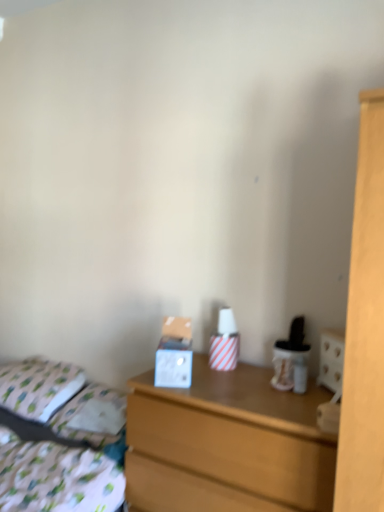
Describe the element at coordinates (227, 444) in the screenshot. The height and width of the screenshot is (512, 384). I see `wooden chest of drawers at center` at that location.

The height and width of the screenshot is (512, 384). What are the coordinates of `wooden chest of drawers at center` in the screenshot? It's located at (227, 444).

Is point (116, 481) positioned after point (169, 437)?

Yes, point (116, 481) is farther from viewer.

Who is bigger, patterned fabric bed at lower left or wooden chest of drawers at center?

patterned fabric bed at lower left.

Is patterned fabric bed at lower left looking in the opposite direction of wooden chest of drawers at center?

No, patterned fabric bed at lower left is not facing away from wooden chest of drawers at center.

Which of these two, wooden chest of drawers at center or patterned fabric bed at lower left, is bigger?

patterned fabric bed at lower left.

Does wooden chest of drawers at center come behind patterned fabric bed at lower left?

Yes, it is behind patterned fabric bed at lower left.

Which is less distant, [197,393] or [23,445]?

The point [197,393] is in front.

Based on the photo, is wooden chest of drawers at center positioned with its back to patterned fabric bed at lower left?

wooden chest of drawers at center is not turned away from patterned fabric bed at lower left.

Is patterned fabric bed at lower left looking in the opposite direction of white fabric pillow at left?

patterned fabric bed at lower left does not have its back to white fabric pillow at left.

From the image's perspective, is patterned fabric bed at lower left on top of white fabric pillow at left?

No, from the image's perspective, patterned fabric bed at lower left is not above white fabric pillow at left.

From a real-world perspective, who is located higher, patterned fabric bed at lower left or white fabric pillow at left?

white fabric pillow at left.

Considering the positions of objects white fabric pillow at left and wooden chest of drawers at center in the image provided, who is more to the left, white fabric pillow at left or wooden chest of drawers at center?

white fabric pillow at left.

From the image's perspective, does white fabric pillow at left appear lower than wooden chest of drawers at center?

Incorrect, from the image's perspective, white fabric pillow at left is higher than wooden chest of drawers at center.

Does point (55, 408) lie behind point (204, 388)?

Yes, point (55, 408) is farther from viewer.

Looking at the image, does white fabric pillow at left seem bigger or smaller compared to wooden chest of drawers at center?

white fabric pillow at left is smaller than wooden chest of drawers at center.

Which is in front, point (165, 454) or point (20, 398)?

The point (165, 454) is closer to the camera.

Could you tell me if wooden chest of drawers at center is facing white fabric pillow at left?

No, wooden chest of drawers at center is not aimed at white fabric pillow at left.

Between wooden chest of drawers at center and white fabric pillow at left, which one is positioned in front?

Positioned in front is wooden chest of drawers at center.

Would you say wooden chest of drawers at center is to the left or to the right of white fabric pillow at left in the picture?

Clearly, wooden chest of drawers at center is on the right of white fabric pillow at left in the image.

Which is more to the right, white fabric pillow at left or patterned fabric bed at lower left?

From the viewer's perspective, patterned fabric bed at lower left appears more on the right side.

What's the angular difference between white fabric pillow at left and patterned fabric bed at lower left's facing directions?

3.65 degrees.

Would you say patterned fabric bed at lower left is part of white fabric pillow at left's contents?

No, patterned fabric bed at lower left is not surrounded by white fabric pillow at left.

Based on the photo, between white fabric pillow at left and patterned fabric bed at lower left, which one has less height?

white fabric pillow at left is shorter.

Where is `bed located below the wooden chest of drawers at center (from the image's perspective)`? The width and height of the screenshot is (384, 512). bed located below the wooden chest of drawers at center (from the image's perspective) is located at coordinates (59, 439).

At what (x,y) coordinates should I click in order to perform the action: click on bed that appears below the wooden chest of drawers at center (from a real-world perspective). Please return your answer as a coordinate pair (x, y). This screenshot has height=512, width=384. Looking at the image, I should click on (59, 439).

Which object lies further to the anchor point wooden chest of drawers at center, white fabric pillow at left or patterned fabric bed at lower left?

white fabric pillow at left is further to wooden chest of drawers at center.

Based on their spatial positions, is wooden chest of drawers at center or patterned fabric bed at lower left closer to white fabric pillow at left?

The object closer to white fabric pillow at left is patterned fabric bed at lower left.

Looking at the image, which one is located further to patterned fabric bed at lower left, white fabric pillow at left or wooden chest of drawers at center?

wooden chest of drawers at center is positioned further to the anchor patterned fabric bed at lower left.

Considering their positions, is patterned fabric bed at lower left positioned closer to white fabric pillow at left than wooden chest of drawers at center?

patterned fabric bed at lower left is closer to white fabric pillow at left.

Considering their positions, is patterned fabric bed at lower left positioned further to wooden chest of drawers at center than white fabric pillow at left?

Based on the image, white fabric pillow at left appears to be further to wooden chest of drawers at center.

Based on their spatial positions, is wooden chest of drawers at center or white fabric pillow at left further from patterned fabric bed at lower left?

wooden chest of drawers at center is positioned further to the anchor patterned fabric bed at lower left.

Find the location of a particular element. bed between white fabric pillow at left and wooden chest of drawers at center is located at coordinates (59, 439).